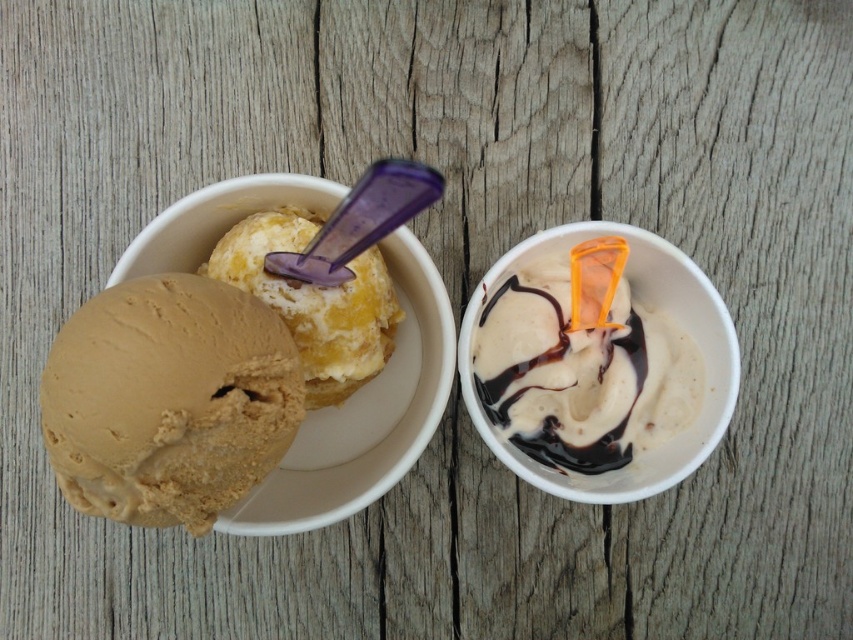
Question: Can you confirm if white glossy ice cream at center is bigger than vanilla ice cream at upper left?

Choices:
 (A) no
 (B) yes

Answer: (A)

Question: Among these points, which one is nearest to the camera?

Choices:
 (A) (x=170, y=465)
 (B) (x=657, y=401)
 (C) (x=311, y=397)
 (D) (x=428, y=374)

Answer: (A)

Question: Which object is farther from the camera taking this photo?

Choices:
 (A) white glossy ice cream at center
 (B) vanilla ice cream at upper left
 (C) matte plastic bowl at upper left

Answer: (A)

Question: Does matte plastic bowl at upper left have a greater width compared to vanilla ice cream at upper left?

Choices:
 (A) no
 (B) yes

Answer: (B)

Question: Which of the following is the closest to the observer?

Choices:
 (A) vanilla ice cream at upper left
 (B) matte plastic bowl at upper left
 (C) golden brown ice cream at left
 (D) white glossy ice cream at center

Answer: (C)

Question: Can you confirm if golden brown ice cream at left is positioned to the right of matte plastic bowl at upper left?

Choices:
 (A) yes
 (B) no

Answer: (B)